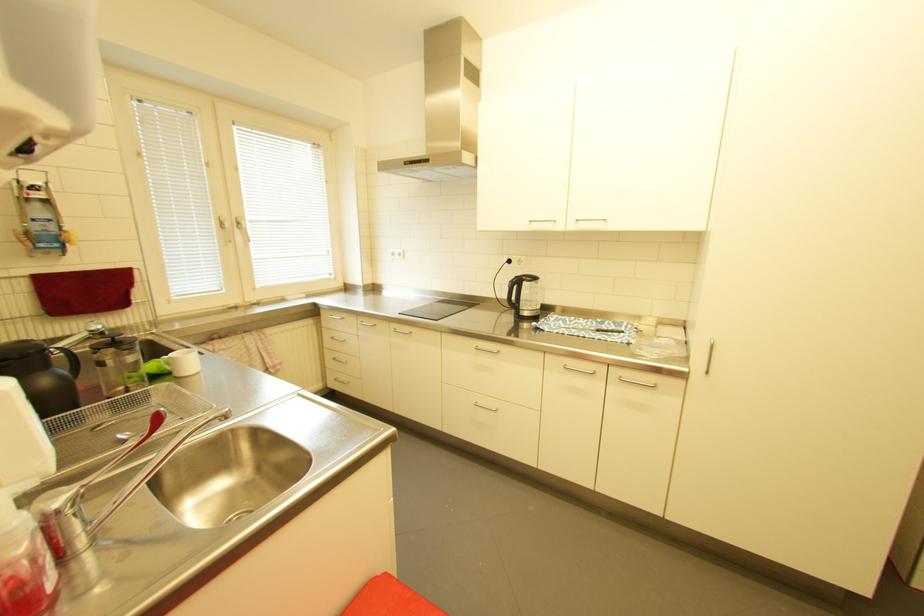
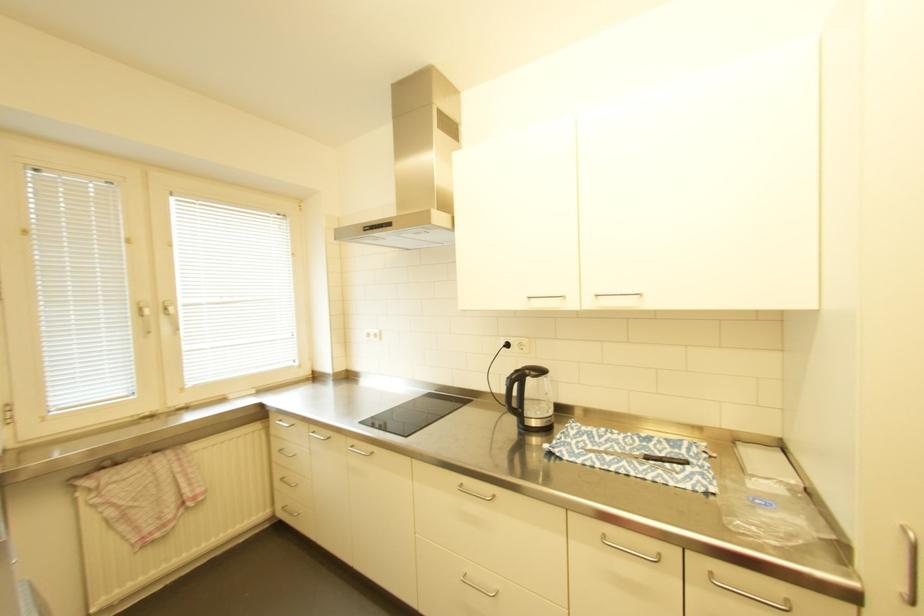
Where in the second image is the point corresponding to pixel 339 339 from the first image?

(287, 451)